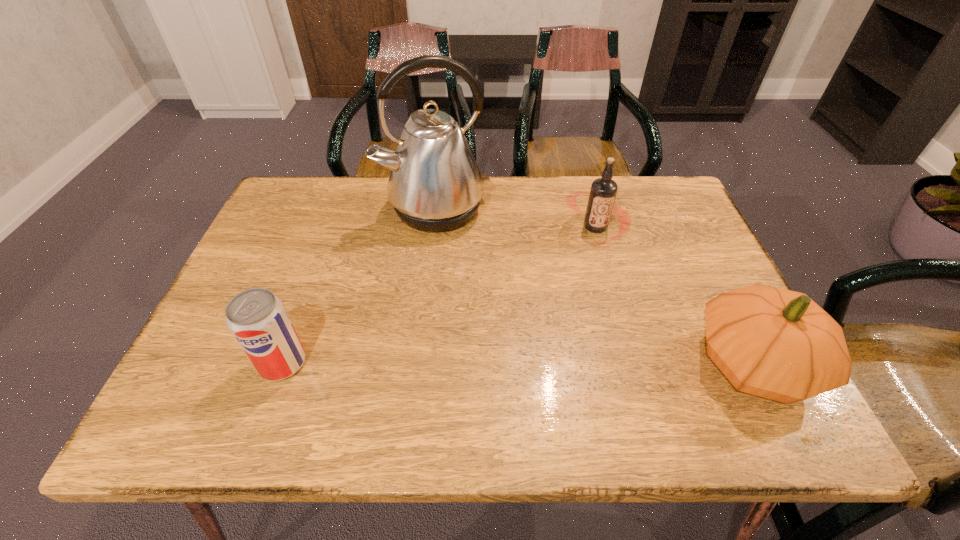
The width and height of the screenshot is (960, 540). I want to click on vacant space at the far edge, so click(x=545, y=202).

In the image, there is a desktop. At what (x,y) coordinates should I click in order to perform the action: click on vacant area at the near edge. Please return your answer as a coordinate pair (x, y). Image resolution: width=960 pixels, height=540 pixels. Looking at the image, I should click on (446, 360).

Image resolution: width=960 pixels, height=540 pixels. In order to click on vacant space at the left edge of the desktop in this screenshot , I will do `click(276, 269)`.

Identify the location of vacant space at the right edge of the desktop. This screenshot has width=960, height=540. (711, 291).

This screenshot has height=540, width=960. I want to click on free region at the far left corner, so click(x=268, y=224).

What are the coordinates of `free space at the far right corner` in the screenshot? It's located at (644, 221).

Identify the location of free space that is in between the third object from left to right and the leftmost object. (439, 295).

At what (x,y) coordinates should I click in order to perform the action: click on empty space between the leftmost object and the second object from left to right. Please return your answer as a coordinate pair (x, y). Looking at the image, I should click on tap(359, 286).

This screenshot has height=540, width=960. Find the location of `vacant area that lies between the root beer and the gourd`. vacant area that lies between the root beer and the gourd is located at coordinates (675, 295).

Find the location of a particular element. This screenshot has height=540, width=960. vacant point located between the soda and the third object from left to right is located at coordinates (439, 295).